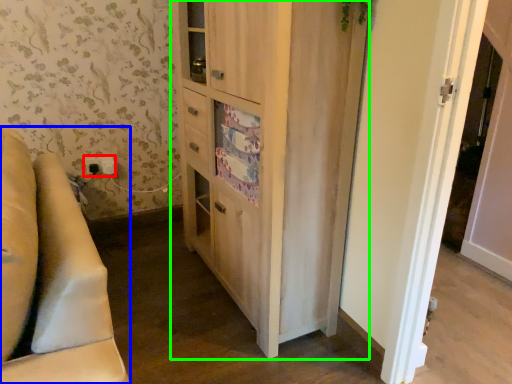
Question: Which object is the farthest from electric outlet (highlighted by a red box)? Choose among these: furniture (highlighted by a blue box) or cabinetry (highlighted by a green box).

Choices:
 (A) furniture
 (B) cabinetry

Answer: (A)